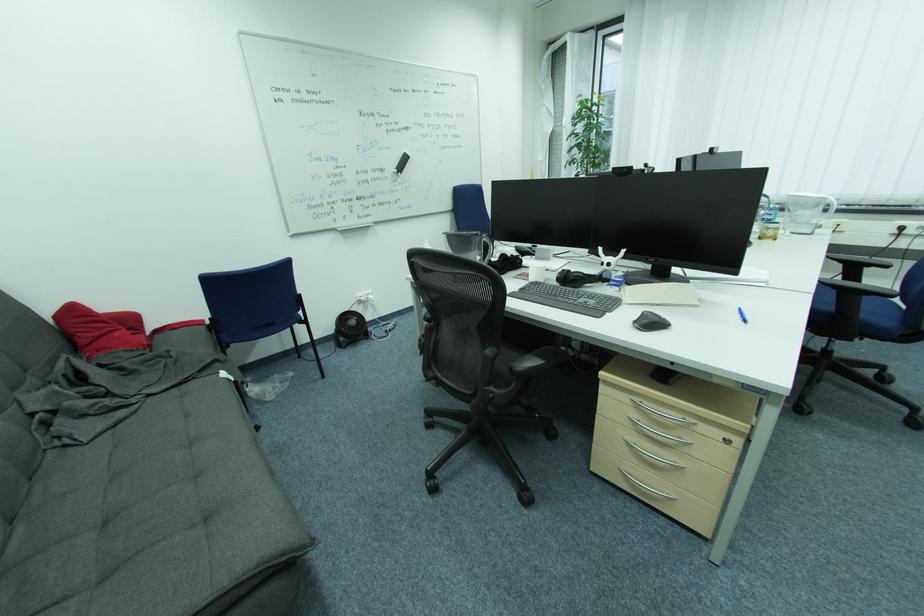
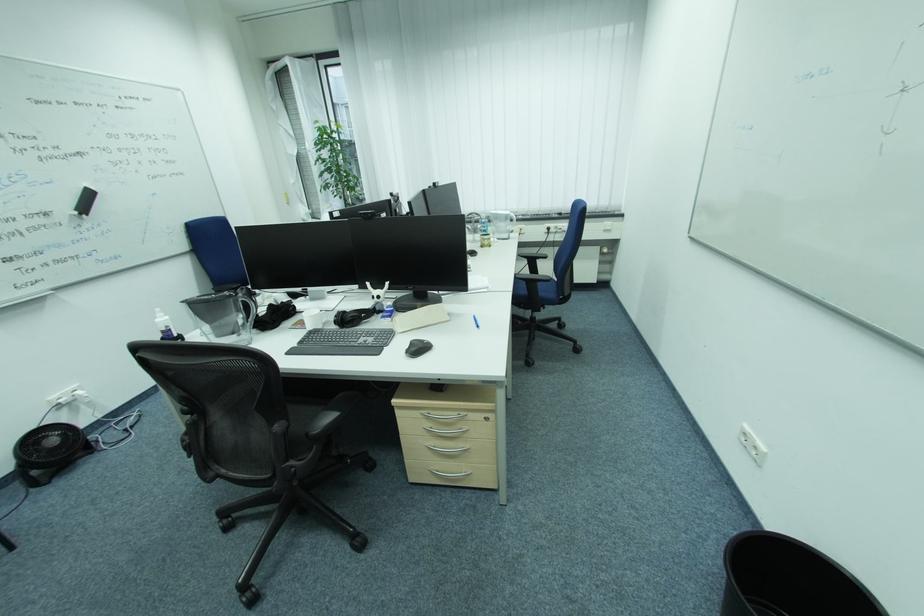
The point at [504,357] is marked in the first image. Where is the corresponding point in the second image?

(294, 429)